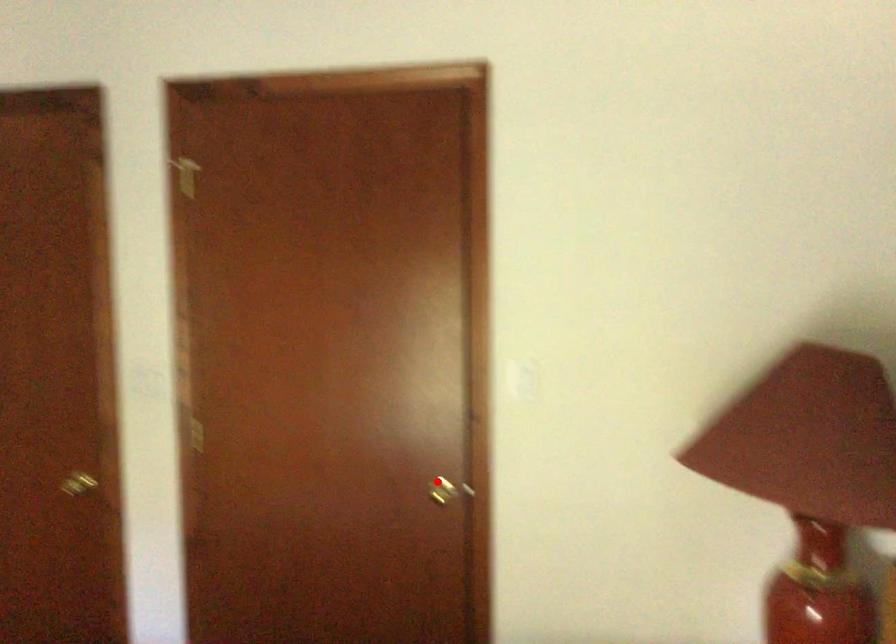
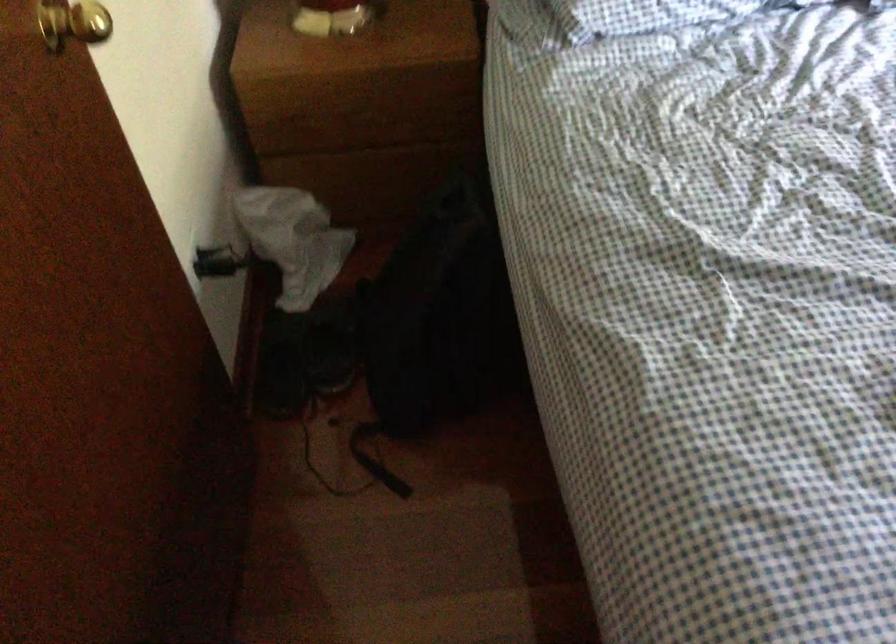
The point at the highlighted location is marked in the first image. Where is the corresponding point in the second image?

(73, 23)